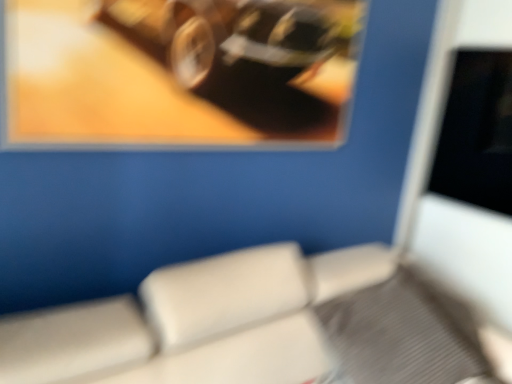
Question: Based on their sizes in the image, would you say metallic reflective frame at upper left is bigger or smaller than beige leather chair at lower center?

Choices:
 (A) small
 (B) big

Answer: (A)

Question: Is metallic reflective frame at upper left in front of or behind beige leather chair at lower center in the image?

Choices:
 (A) behind
 (B) front

Answer: (A)

Question: From the image's perspective, is metallic reflective frame at upper left above or below beige leather chair at lower center?

Choices:
 (A) above
 (B) below

Answer: (A)

Question: Is beige leather chair at lower center taller or shorter than metallic reflective frame at upper left?

Choices:
 (A) short
 (B) tall

Answer: (A)

Question: Relative to metallic reflective frame at upper left, is beige leather chair at lower center in front or behind?

Choices:
 (A) behind
 (B) front

Answer: (B)

Question: From a real-world perspective, is beige leather chair at lower center above or below metallic reflective frame at upper left?

Choices:
 (A) above
 (B) below

Answer: (B)

Question: Looking at the image, does beige leather chair at lower center seem bigger or smaller compared to metallic reflective frame at upper left?

Choices:
 (A) small
 (B) big

Answer: (B)